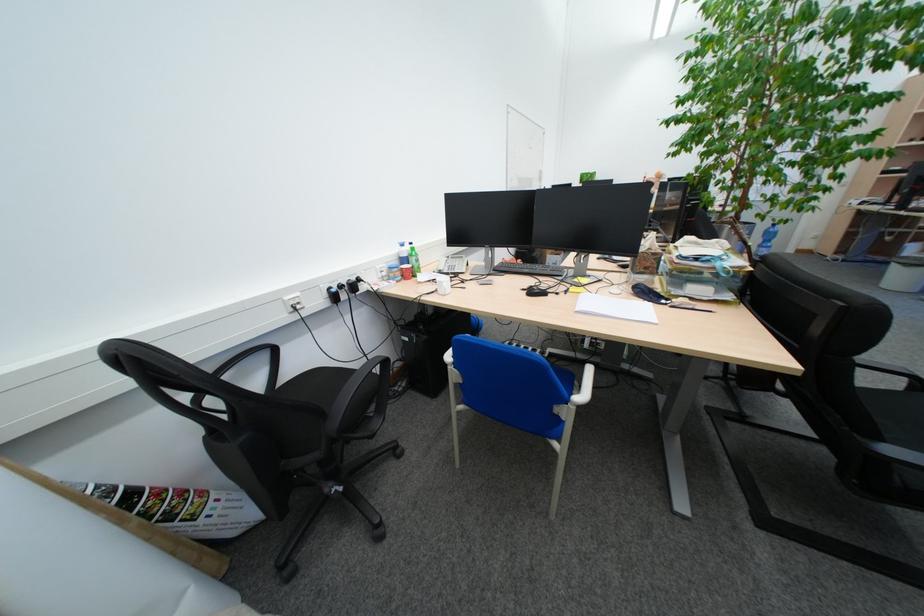
The image size is (924, 616). In order to click on black chair armrest in this screenshot , I will do `click(371, 402)`.